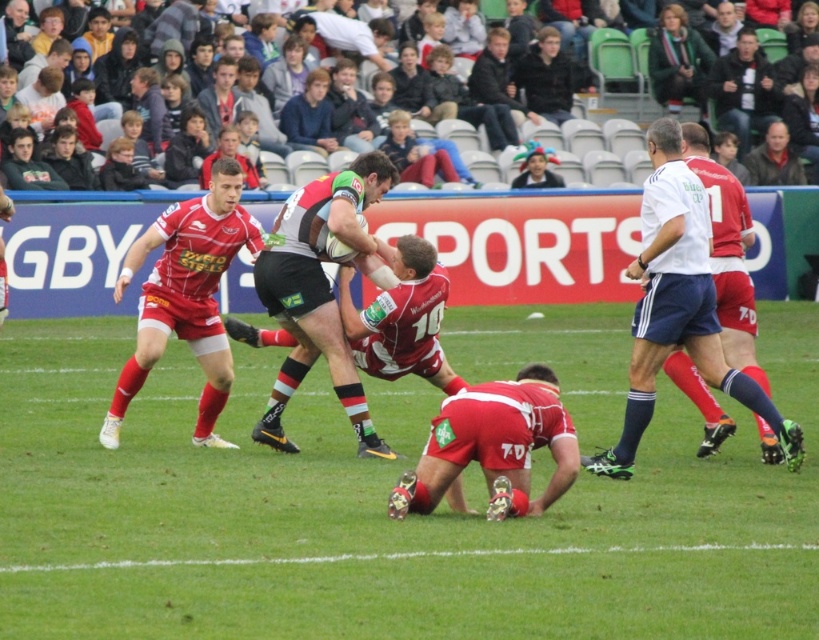
Question: Does green grass at center appear on the left side of light brown leather jacket at upper center?

Choices:
 (A) yes
 (B) no

Answer: (A)

Question: Among these objects, which one is nearest to the camera?

Choices:
 (A) white smooth referee at right
 (B) green textured rugby ball at center

Answer: (A)

Question: Does light brown leather jacket at upper center have a smaller size compared to multicolored fabric hat at upper center?

Choices:
 (A) no
 (B) yes

Answer: (B)

Question: Does light brown leather jacket at upper center appear over multicolored fabric hat at upper center?

Choices:
 (A) no
 (B) yes

Answer: (B)

Question: Which object is farther from the camera taking this photo?

Choices:
 (A) white smooth referee at right
 (B) red matte jersey at lower center
 (C) green grass at center

Answer: (A)

Question: Estimate the real-world distances between objects in this image. Which object is closer to the green textured rugby ball at center?

Choices:
 (A) matte red rugby player at center
 (B) multicolored fabric hat at upper center
 (C) red matte jersey at lower center

Answer: (C)